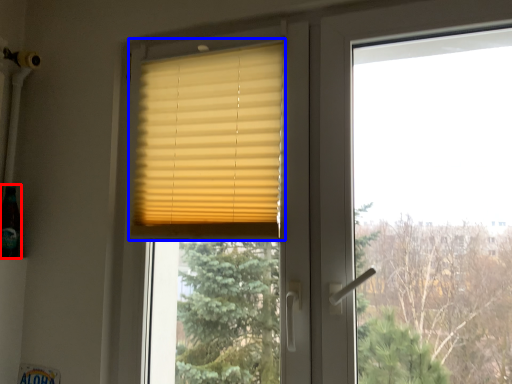
Question: Which point is further to the camera, champagne (highlighted by a red box) or window blind (highlighted by a blue box)?

Choices:
 (A) champagne
 (B) window blind

Answer: (A)